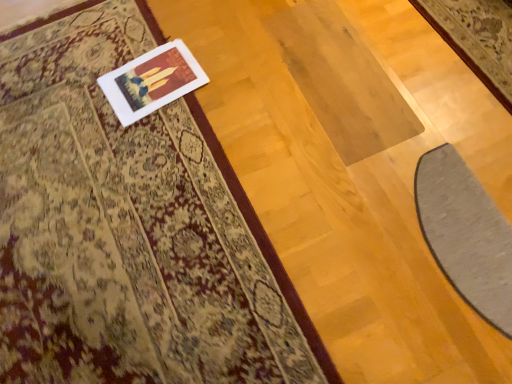
Locate an element on the screen. The height and width of the screenshot is (384, 512). free space above silky beige rug at upper left (from a real-world perspective) is located at coordinates (101, 188).